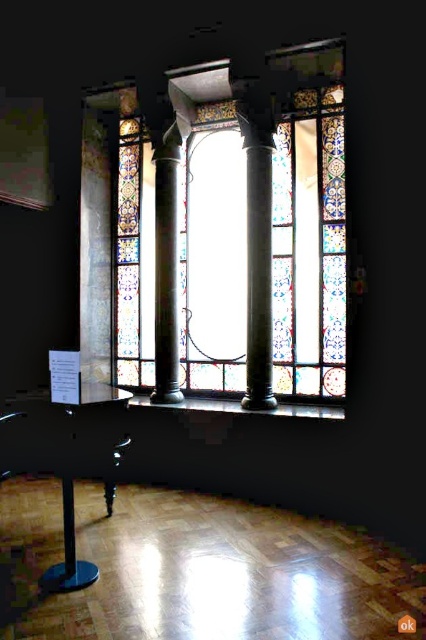
You are a visitor in this space and want to take a photo of the polished marble column at center and the black plastic stool at lower left. Which object will appear taller in the photo?

The polished marble column at center will appear taller in the photo because it has a greater height compared to the black plastic stool at lower left.